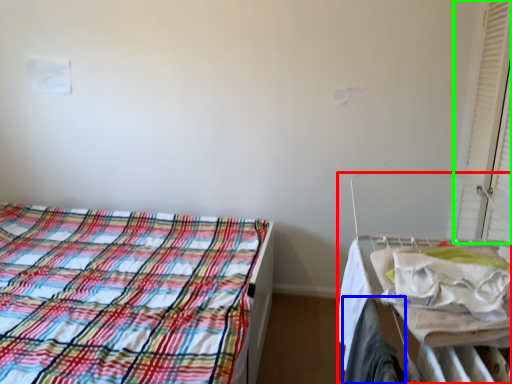
Question: Which object is positioned closest to hospital bed (highlighted by a red box)? Select from clothing (highlighted by a blue box) and curtain (highlighted by a green box).

Choices:
 (A) clothing
 (B) curtain

Answer: (A)